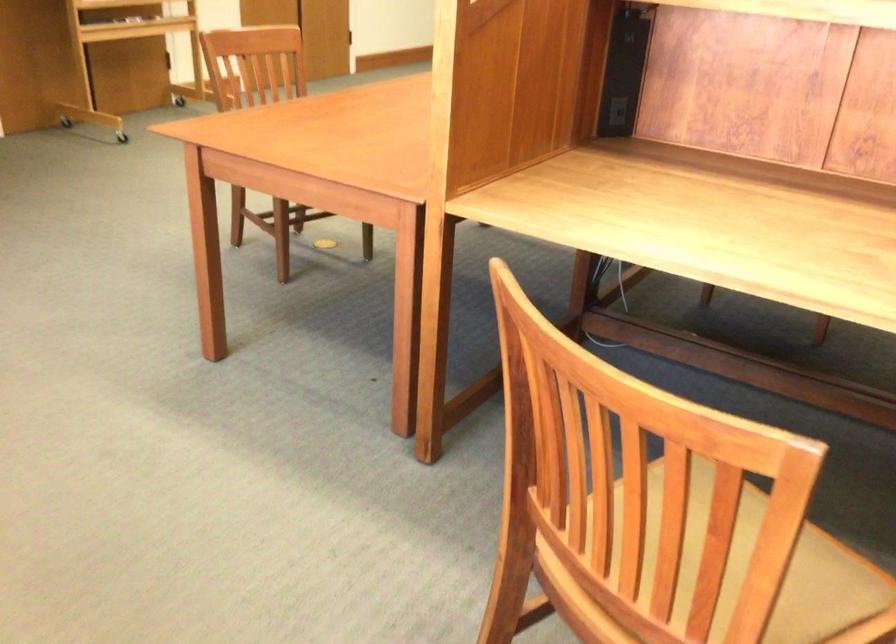
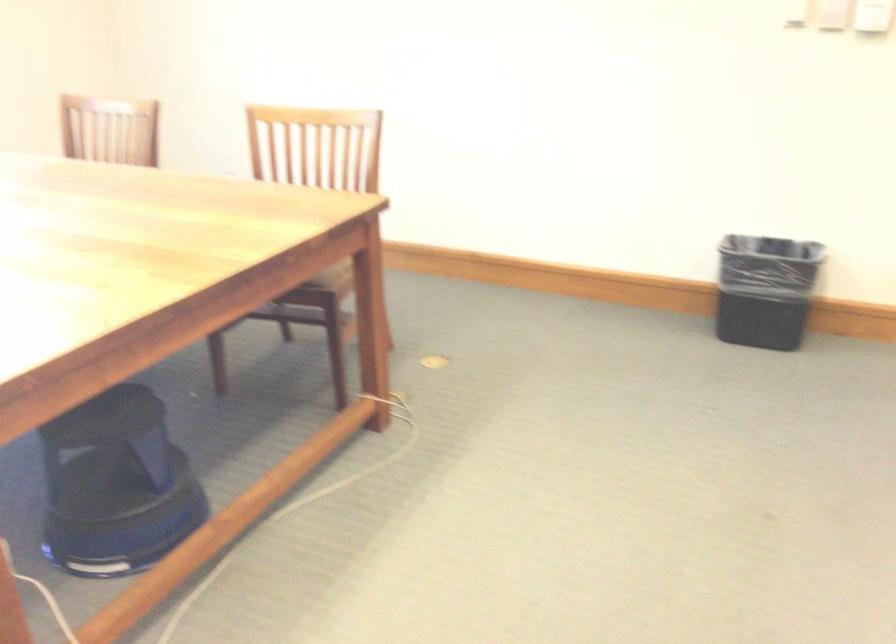
Question: The camera is either moving clockwise (left) or counter-clockwise (right) around the object. The first image is from the beginning of the video and the second image is from the end. Is the camera moving left or right when shooting the video?

Choices:
 (A) Left
 (B) Right

Answer: (B)